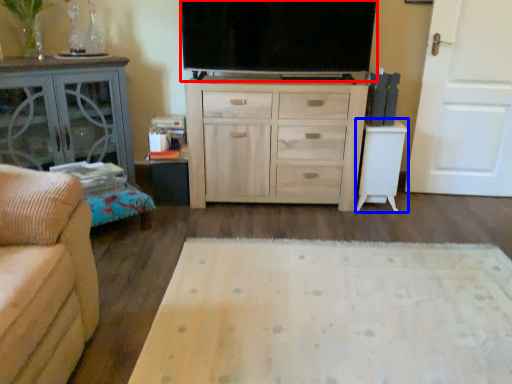
Question: Among these objects, which one is farthest to the camera, television (highlighted by a red box) or table (highlighted by a blue box)?

Choices:
 (A) television
 (B) table

Answer: (B)